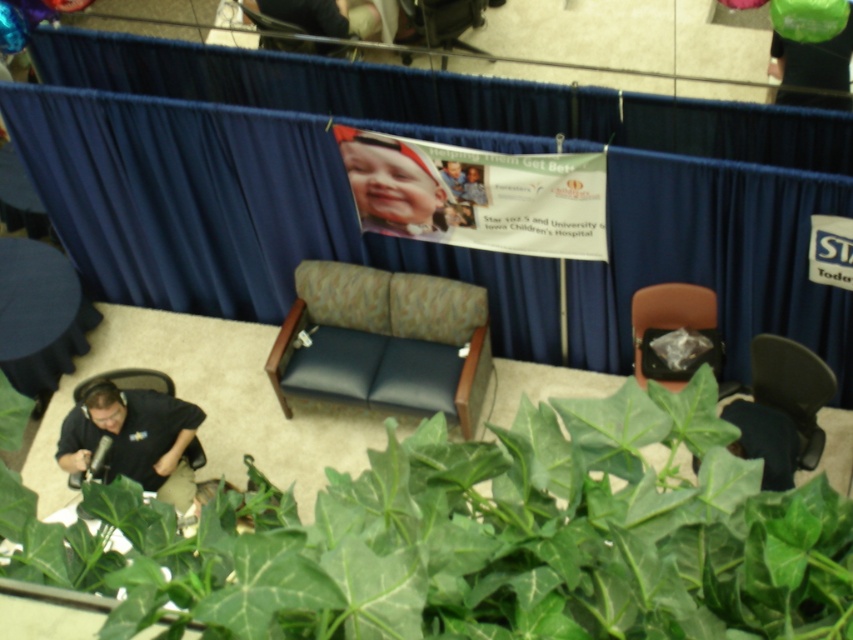
You are organizing an event and need to place a 1.2 meter wide screen between the dark blue leather armchair at center and the matte black bag at right. Based on their sizes, can the screen fit between them?

The dark blue leather armchair at center is wider than the matte black bag at right. Since the screen is 1.2 meters wide, it depends on the combined width of both objects. However, the description only states the armchair is wider, not the exact dimensions. Without knowing the exact widths, we cannot definitively determine if the screen will fit.